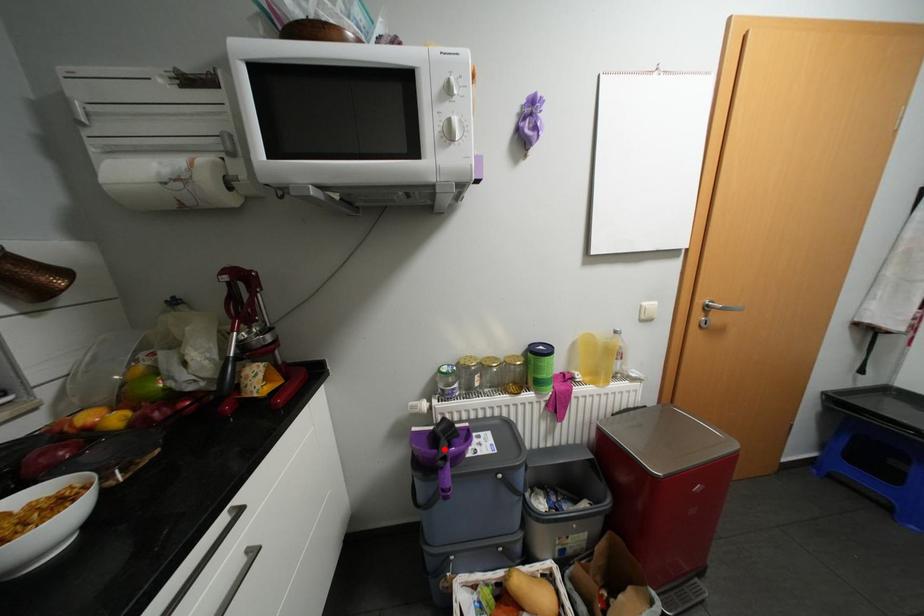
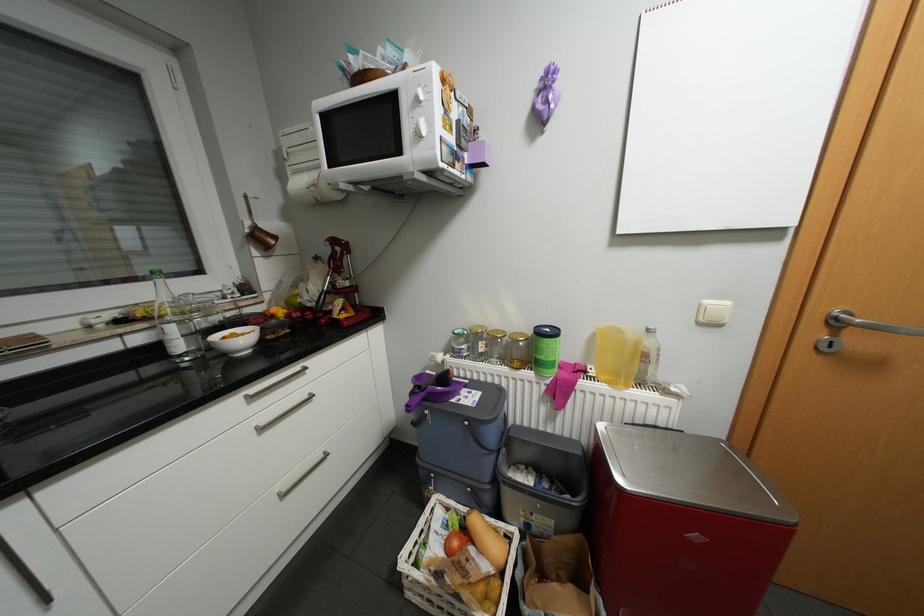
Where in the second image is the point corresponding to the highlighted location from the first image?

(441, 389)